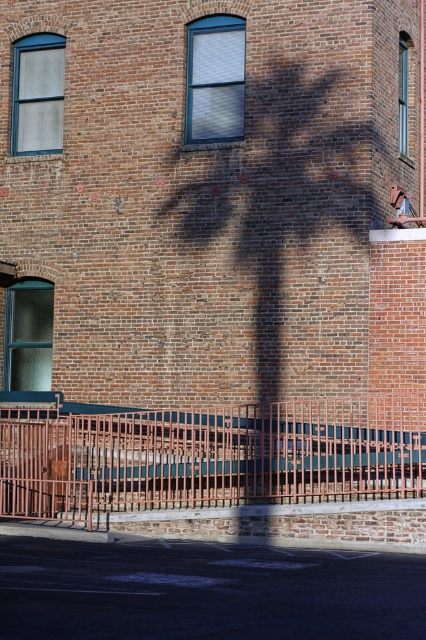
You are standing in front of a brick building with three windows. You notice a point marked at coordinates (265, 244). What object is located at this point?

The point at (265, 244) indicates a brown textured tree at center.

You are standing in front of a brick building with a shadow cast by the brown textured tree at center. Based on the shadow position, can you determine the time of day the photo was taken?

The shadow cast by the brown textured tree at center is located at point (265, 244), which suggests the photo was taken during early morning or late afternoon when the sun is at a low angle.

You are standing in front of a brick building and see the brown textured tree at center and the rusty metal fence at lower center. Which object is closer to you?

The rusty metal fence at lower center is closer to you because the brown textured tree at center is positioned over it, indicating it is behind the fence.